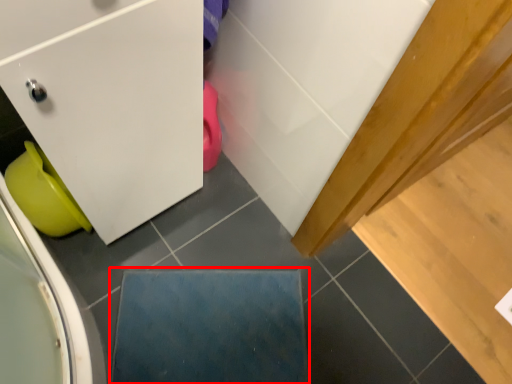
Question: From the image, what is the correct spatial relationship of slate (annotated by the red box) in relation to toilet bowl?

Choices:
 (A) left
 (B) right

Answer: (B)